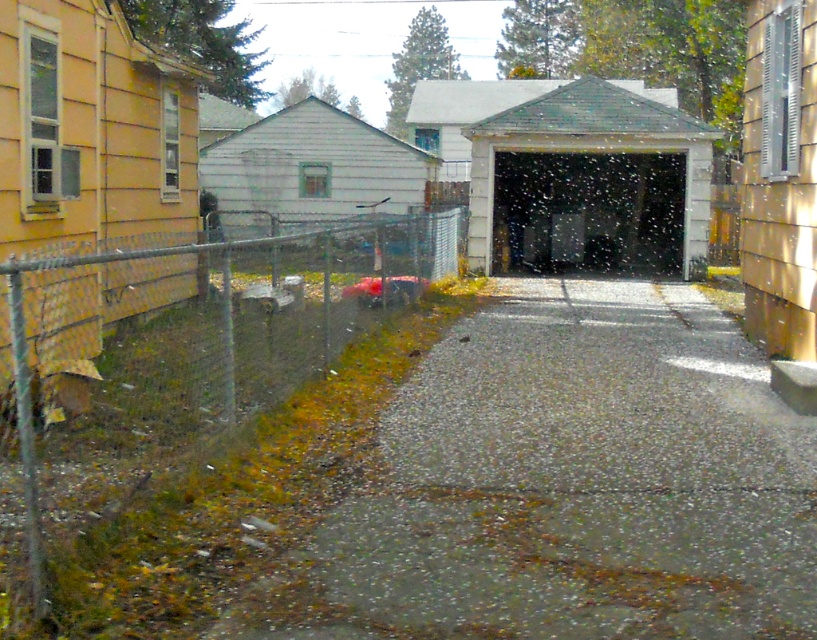
You are standing at the point marked as point (569, 484) in the image. What is the object directly beneath your feet?

The gravelly asphalt driveway at center is located at point (569, 484), so the object directly beneath your feet is the gravelly asphalt driveway at center.